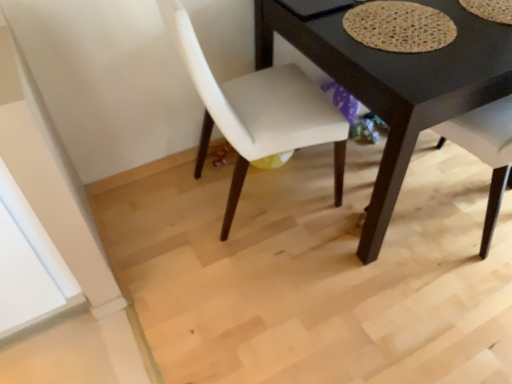
At what (x,y) coordinates should I click in order to perform the action: click on empty space that is in between black matte table at center and white fabric chair at center. Please return your answer as a coordinate pair (x, y). Looking at the image, I should click on (291, 239).